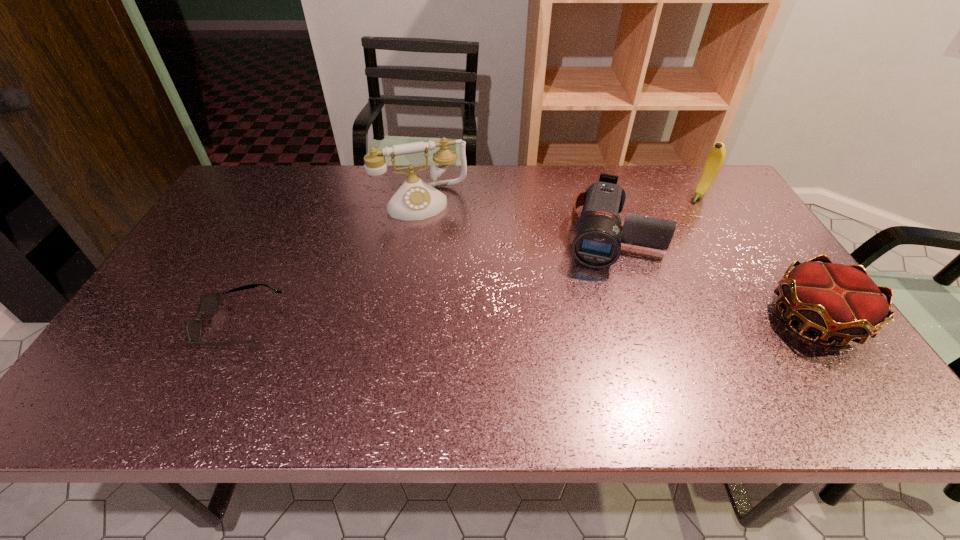
What are the coordinates of `free space on the desktop that is between the leftmost object and the crown and is positioned on the dial of the fourth object from right to left` in the screenshot? It's located at pyautogui.click(x=462, y=323).

Image resolution: width=960 pixels, height=540 pixels. I want to click on free space on the desktop that is between the sunglasses and the crown and is positioned from the stem of the banana, so [x=597, y=321].

Where is `vacant space on the desktop that is between the shortest object and the crown and is positioned on the lens of the third object from right to left`? vacant space on the desktop that is between the shortest object and the crown and is positioned on the lens of the third object from right to left is located at coordinates (593, 321).